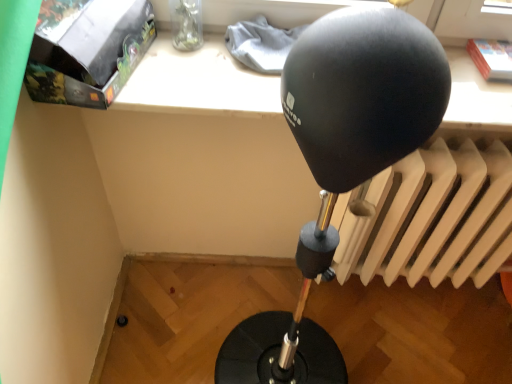
I want to click on unoccupied region to the right of matte black box at upper left, so [x=190, y=77].